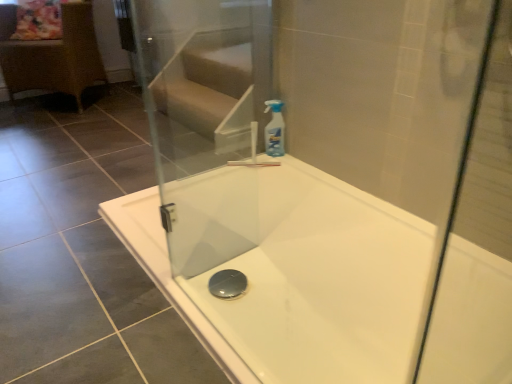
Find the location of a particular element. Image resolution: width=512 pixels, height=384 pixels. vacant space in rattan wicker chair at left (from a real-world perspective) is located at coordinates (64, 104).